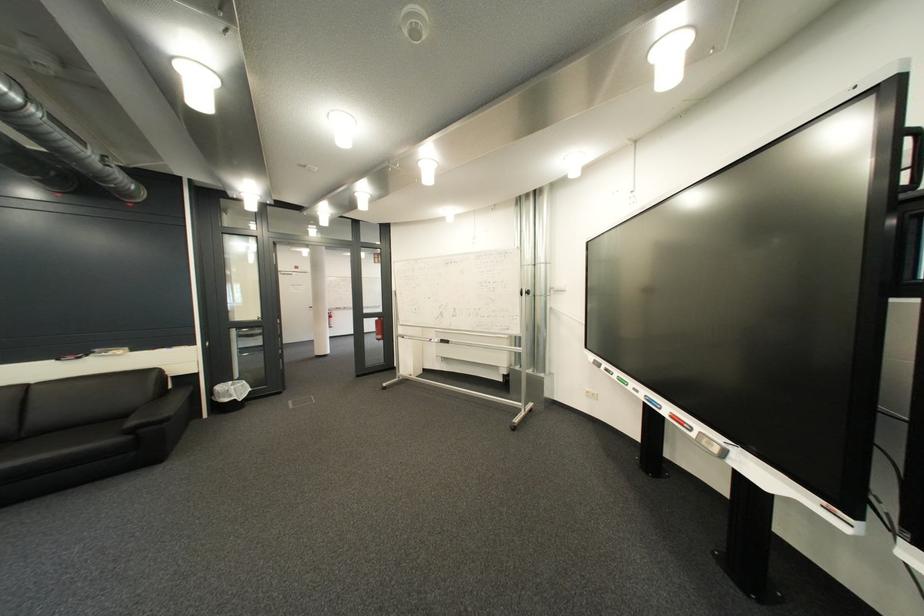
Find where to pull the door lever handle. Please return your answer as a coordinate pair (x, y).

(525, 292)